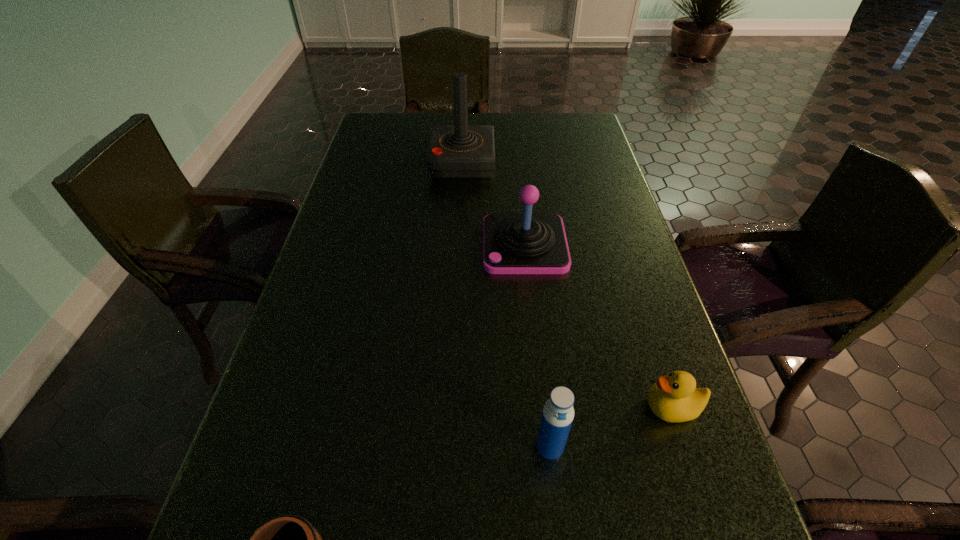
This screenshot has height=540, width=960. I want to click on the tallest object, so click(455, 151).

The height and width of the screenshot is (540, 960). What are the coordinates of `the farther joystick` in the screenshot? It's located at (455, 151).

At what (x,y) coordinates should I click in order to perform the action: click on the shorter joystick. Please return your answer as a coordinate pair (x, y). Looking at the image, I should click on (513, 243).

Image resolution: width=960 pixels, height=540 pixels. What are the coordinates of `the nearer joystick` in the screenshot? It's located at (513, 243).

At what (x,y) coordinates should I click in order to perform the action: click on water bottle. Please return your answer as a coordinate pair (x, y). The image size is (960, 540). Looking at the image, I should click on (558, 413).

Locate an element on the screen. the third farthest object is located at coordinates click(x=674, y=398).

Locate an element on the screen. This screenshot has height=540, width=960. duck is located at coordinates (674, 398).

Find the location of `vacant space located 0.110m on the rectangular base of the farther joystick`. vacant space located 0.110m on the rectangular base of the farther joystick is located at coordinates (530, 163).

Identify the location of vacant space situated forward from the base of the shorter joystick. This screenshot has height=540, width=960. (340, 245).

You are a GUI agent. You are given a task and a screenshot of the screen. Output one action in this format:
    pyautogui.click(x=<x>, y=<y>)
    Task: Click on the vacant space located forward from the base of the shorter joystick
    The image size is (960, 540).
    Given the screenshot: What is the action you would take?
    pyautogui.click(x=327, y=245)